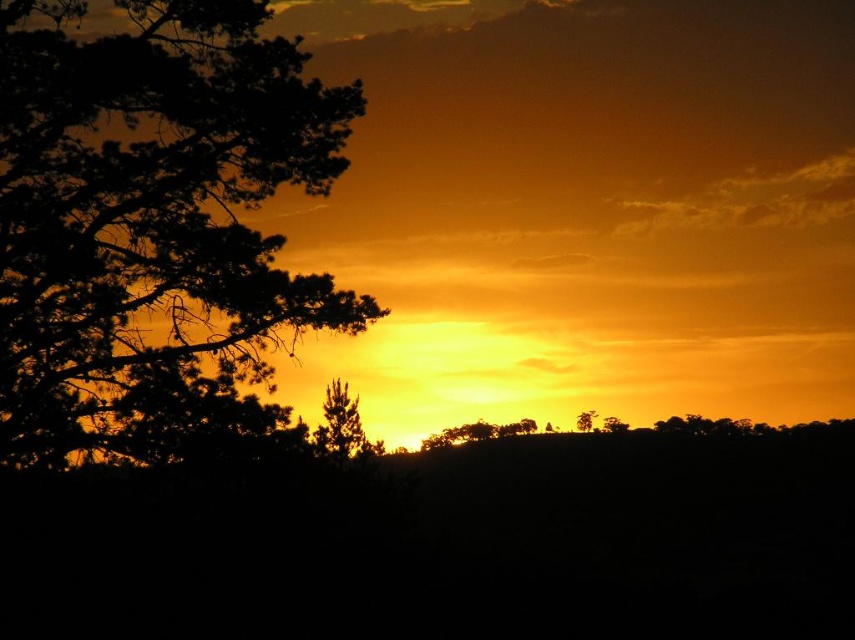
Between silhouette bark tree at left and green textured pine tree at center, which one is positioned higher?

silhouette bark tree at left

Does silhouette bark tree at left appear on the right side of green textured pine tree at center?

In fact, silhouette bark tree at left is to the left of green textured pine tree at center.

Does point (128, 161) come behind point (345, 397)?

No, it is in front of (345, 397).

Where is `silhouette bark tree at left`? silhouette bark tree at left is located at coordinates (150, 220).

Does silhouette bark tree at left appear on the left side of green matte tree at center?

Correct, you'll find silhouette bark tree at left to the left of green matte tree at center.

The height and width of the screenshot is (640, 855). What are the coordinates of `silhouette bark tree at left` in the screenshot? It's located at (150, 220).

Can you confirm if green textured pine tree at center is taller than green matte tree at center?

Yes, green textured pine tree at center is taller than green matte tree at center.

Is point (316, 448) closer to viewer compared to point (579, 424)?

Yes.

Where is `green textured pine tree at center`? The image size is (855, 640). green textured pine tree at center is located at coordinates (340, 424).